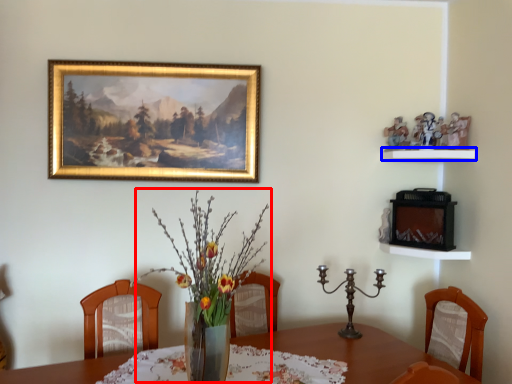
Question: Which object appears closest to the camera in this image, floral arrangement (highlighted by a red box) or shelf (highlighted by a blue box)?

Choices:
 (A) floral arrangement
 (B) shelf

Answer: (A)